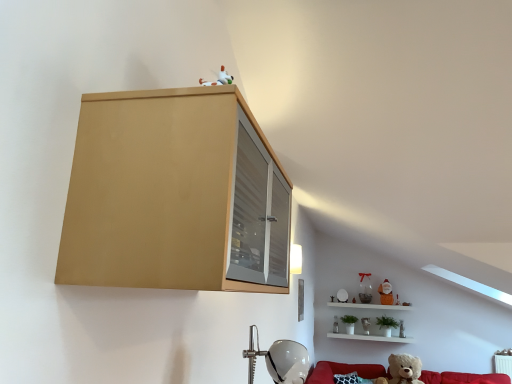
Question: Considering the positions of matte wood cabinet at upper left and matte brown teddy bear at upper right, positioned as the third toy in back-to-front order, in the image, is matte wood cabinet at upper left taller or shorter than matte brown teddy bear at upper right, positioned as the third toy in back-to-front order,?

Choices:
 (A) short
 (B) tall

Answer: (B)

Question: Looking at their shapes, would you say matte wood cabinet at upper left is wider or thinner than matte brown teddy bear at upper right, the fourth toy when ordered from front to back?

Choices:
 (A) wide
 (B) thin

Answer: (A)

Question: Based on their relative distances, which object is farther from the matte wood cabinet at upper left?

Choices:
 (A) matte brown teddy bear at upper right, the fourth toy when ordered from front to back
 (B) white glossy shelf at lower right
 (C) matte white teddy bear at upper right, which is the 6th toy from front to back
 (D) fuzzy beige teddy bear at lower right, the sixth toy viewed from the back
 (E) translucent glass vase at lower right, which is counted as the 2th toy, starting from the front

Answer: (E)

Question: Considering the real-world distances, which object is farthest from the translucent glass vase at lower right, arranged as the fifth toy when viewed from the back?

Choices:
 (A) white matte teddy bear at upper center, which is the 3th toy from front to back
 (B) matte white teddy bear at upper right, the first toy in the back-to-front sequence
 (C) red fabric couch at lower right
 (D) white glossy shelf at lower right
 (E) matte brown teddy bear at upper right, positioned as the third toy in back-to-front order

Answer: (C)